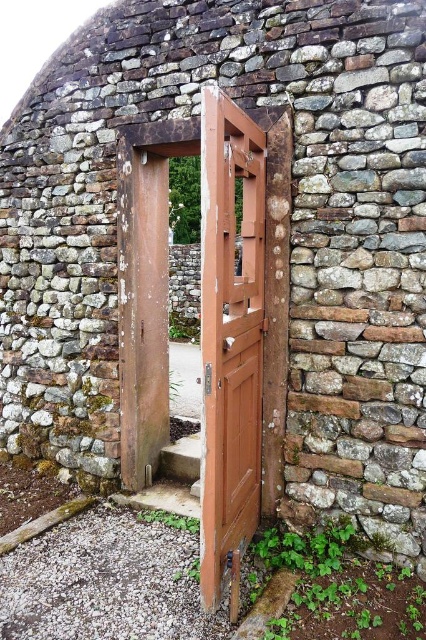
You are standing in front of the rustic stone structure and notice two points marked on the wall. The first point is at coordinate (204, 253) and the second at (216, 240). Which point is closer to you?

Point (204, 253) is closer to you than point (216, 240) because it is further to the viewer.